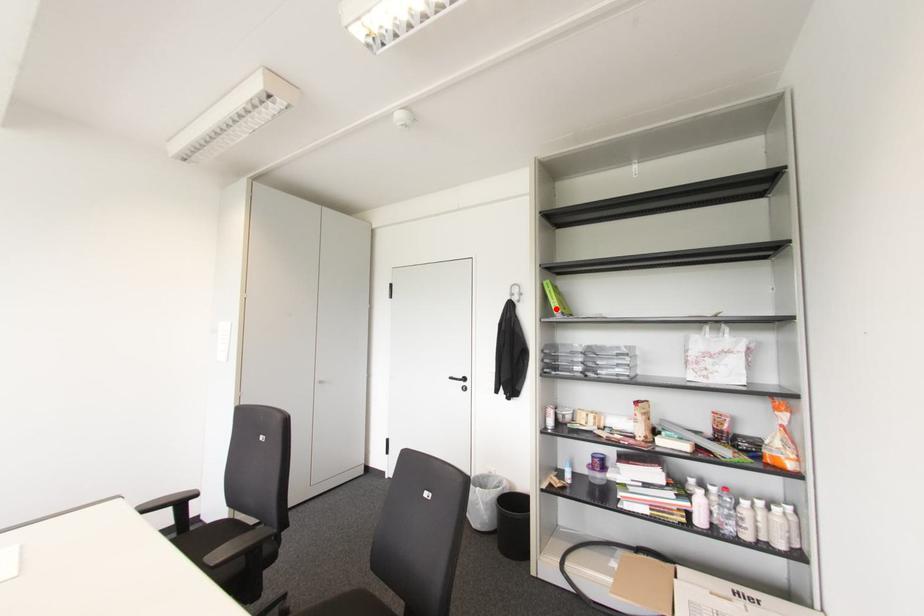
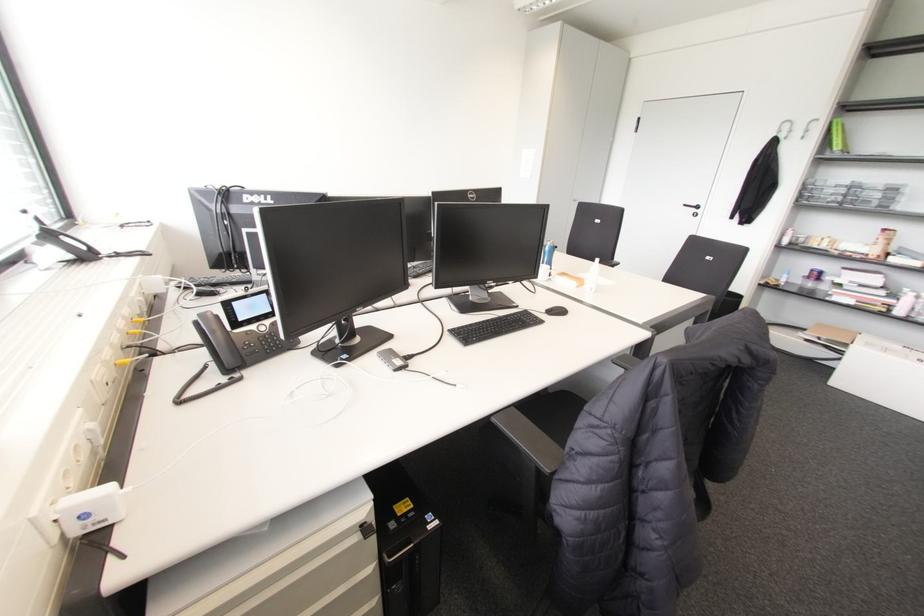
Question: I am providing you with two images of the same scene from different viewpoints. Image1 has a red point marked. In image2, the corresponding 3D location appears at what relative position? Reply with the corresponding letter.

Choices:
 (A) Closer
 (B) Farther

Answer: (B)